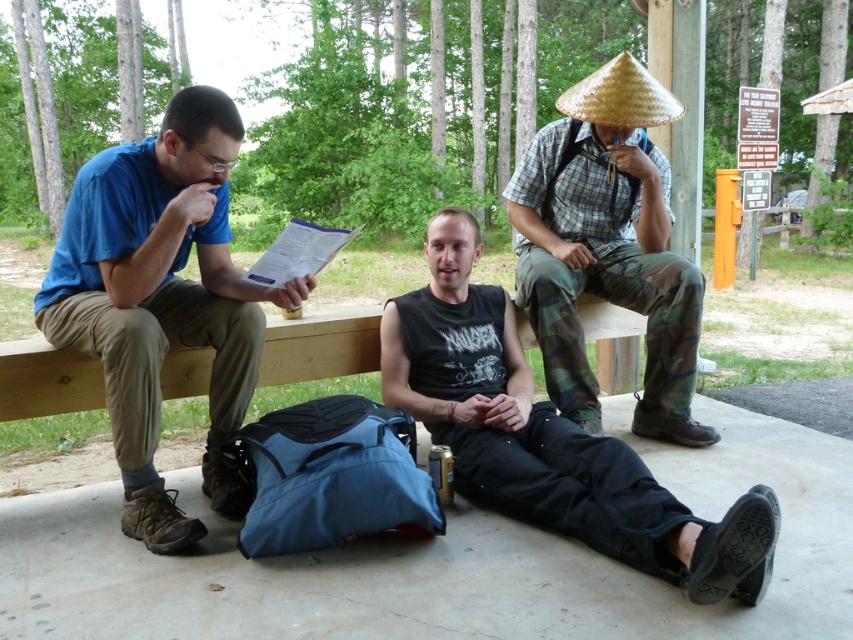
Which is more to the right, matte blue shirt at left or wooden bench at center?

wooden bench at center is more to the right.

Is matte blue shirt at left further to camera compared to wooden bench at center?

No, it is in front of wooden bench at center.

Where is `matte blue shirt at left`? The height and width of the screenshot is (640, 853). matte blue shirt at left is located at coordinates (161, 300).

Locate an element on the screen. Image resolution: width=853 pixels, height=640 pixels. matte blue shirt at left is located at coordinates (161, 300).

Image resolution: width=853 pixels, height=640 pixels. Find the location of `black matte tank top at center`. black matte tank top at center is located at coordinates (547, 435).

Can you confirm if black matte tank top at center is bigger than natural straw hat at upper right?

Indeed, black matte tank top at center has a larger size compared to natural straw hat at upper right.

Which is behind, point (749, 490) or point (579, 369)?

The point (579, 369) is behind.

This screenshot has width=853, height=640. I want to click on black matte tank top at center, so click(x=547, y=435).

The image size is (853, 640). What do you see at coordinates (161, 300) in the screenshot?
I see `matte blue shirt at left` at bounding box center [161, 300].

Which is behind, point (206, 97) or point (572, 310)?

The point (572, 310) is more distant.

Image resolution: width=853 pixels, height=640 pixels. Describe the element at coordinates (161, 300) in the screenshot. I see `matte blue shirt at left` at that location.

At what (x,y) coordinates should I click in order to perform the action: click on matte blue shirt at left. Please return your answer as a coordinate pair (x, y). This screenshot has width=853, height=640. Looking at the image, I should click on (161, 300).